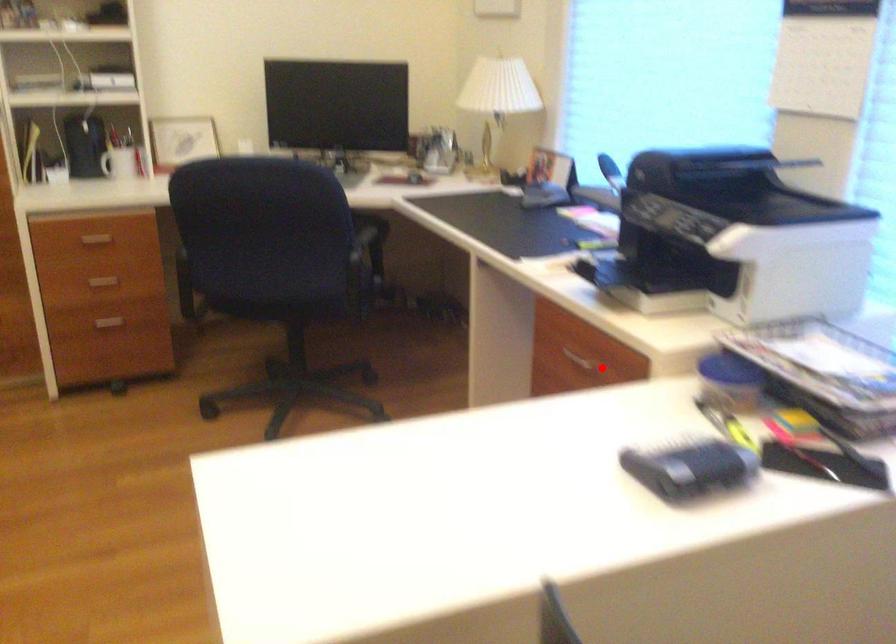
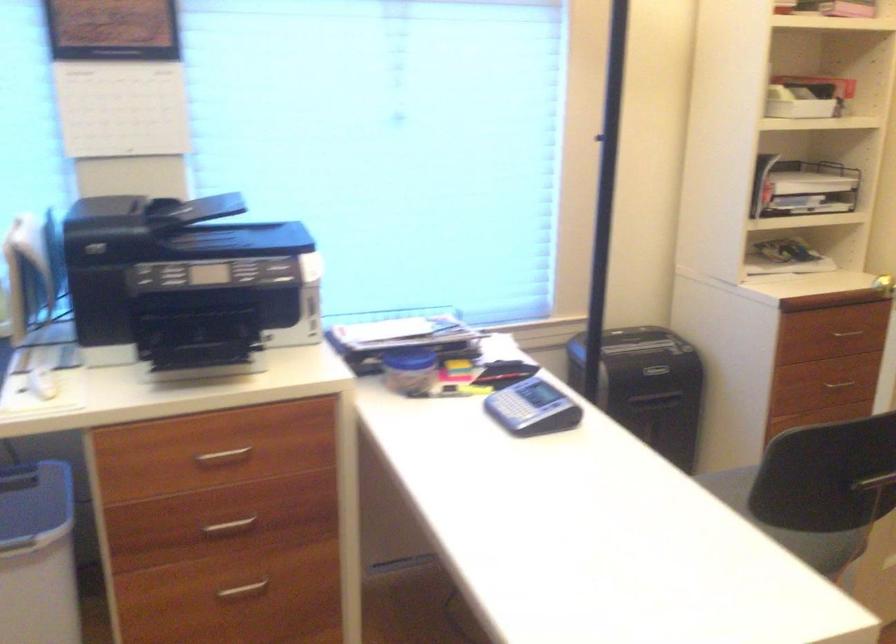
Question: I am providing you with two images of the same scene from different viewpoints. Image1 has a red point marked. In image2, the corresponding 3D location appears at what relative position? Reply with the corresponding letter.

Choices:
 (A) Closer
 (B) Farther

Answer: (A)